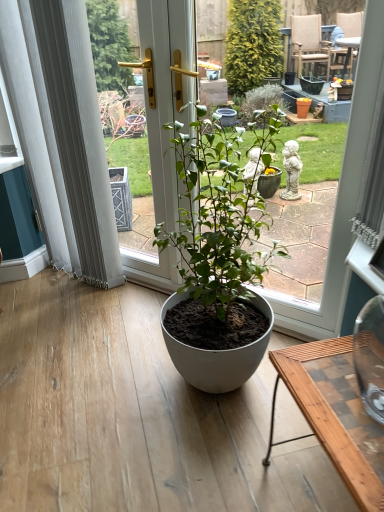
Where is `vacant region above wooden desk at lower right (from a real-world perspective)`? The image size is (384, 512). vacant region above wooden desk at lower right (from a real-world perspective) is located at coordinates (349, 387).